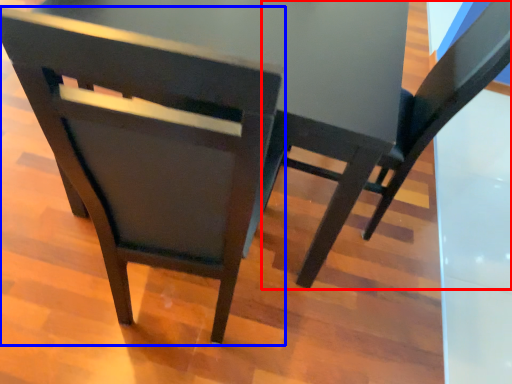
Question: Which object is closer to the camera taking this photo, chair (highlighted by a red box) or chair (highlighted by a blue box)?

Choices:
 (A) chair
 (B) chair

Answer: (B)